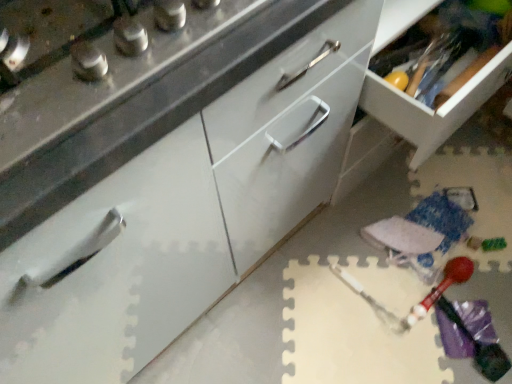
Question: Which direction should I rotate to look at matte white drawer at center, marked as the second cabinetry in a right-to-left arrangement, — up or down?

Choices:
 (A) up
 (B) down

Answer: (A)

Question: Is white glossy drawer at center, the 1th cabinetry in the right-to-left sequence, far from matte white drawer at center, marked as the second cabinetry in a right-to-left arrangement?

Choices:
 (A) no
 (B) yes

Answer: (A)

Question: From the image's perspective, is white glossy drawer at center, the 1th cabinetry in the right-to-left sequence, beneath matte white drawer at center, acting as the first cabinetry starting from the left?

Choices:
 (A) yes
 (B) no

Answer: (B)

Question: From a real-world perspective, is white glossy drawer at center, the 2th cabinetry viewed from the left, on top of matte white drawer at center, acting as the first cabinetry starting from the left?

Choices:
 (A) no
 (B) yes

Answer: (B)

Question: Can you confirm if white glossy drawer at center, the 1th cabinetry in the right-to-left sequence, is wider than matte white drawer at center, marked as the second cabinetry in a right-to-left arrangement?

Choices:
 (A) no
 (B) yes

Answer: (A)

Question: Does white glossy drawer at center, the 2th cabinetry viewed from the left, appear on the left side of matte white drawer at center, acting as the first cabinetry starting from the left?

Choices:
 (A) no
 (B) yes

Answer: (A)

Question: Is white glossy drawer at center, the 1th cabinetry in the right-to-left sequence, further to the viewer compared to matte white drawer at center, acting as the first cabinetry starting from the left?

Choices:
 (A) yes
 (B) no

Answer: (A)

Question: Can you confirm if matte white drawer at center, marked as the second cabinetry in a right-to-left arrangement, is wider than white glossy drawer at center, the 1th cabinetry in the right-to-left sequence?

Choices:
 (A) yes
 (B) no

Answer: (A)

Question: Does matte white drawer at center, acting as the first cabinetry starting from the left, have a lesser height compared to white glossy drawer at center, the 1th cabinetry in the right-to-left sequence?

Choices:
 (A) no
 (B) yes

Answer: (A)

Question: Is the position of matte white drawer at center, marked as the second cabinetry in a right-to-left arrangement, more distant than that of white glossy drawer at center, the 1th cabinetry in the right-to-left sequence?

Choices:
 (A) no
 (B) yes

Answer: (A)

Question: Is matte white drawer at center, marked as the second cabinetry in a right-to-left arrangement, next to white glossy drawer at center, the 1th cabinetry in the right-to-left sequence?

Choices:
 (A) yes
 (B) no

Answer: (B)

Question: From the image's perspective, is matte white drawer at center, acting as the first cabinetry starting from the left, over white glossy drawer at center, the 1th cabinetry in the right-to-left sequence?

Choices:
 (A) no
 (B) yes

Answer: (A)

Question: From the image's perspective, is matte white drawer at center, marked as the second cabinetry in a right-to-left arrangement, below white glossy drawer at center, the 2th cabinetry viewed from the left?

Choices:
 (A) no
 (B) yes

Answer: (B)

Question: From the image's perspective, is matte white drawer at center, marked as the second cabinetry in a right-to-left arrangement, located above or below white glossy drawer at center, the 1th cabinetry in the right-to-left sequence?

Choices:
 (A) above
 (B) below

Answer: (B)